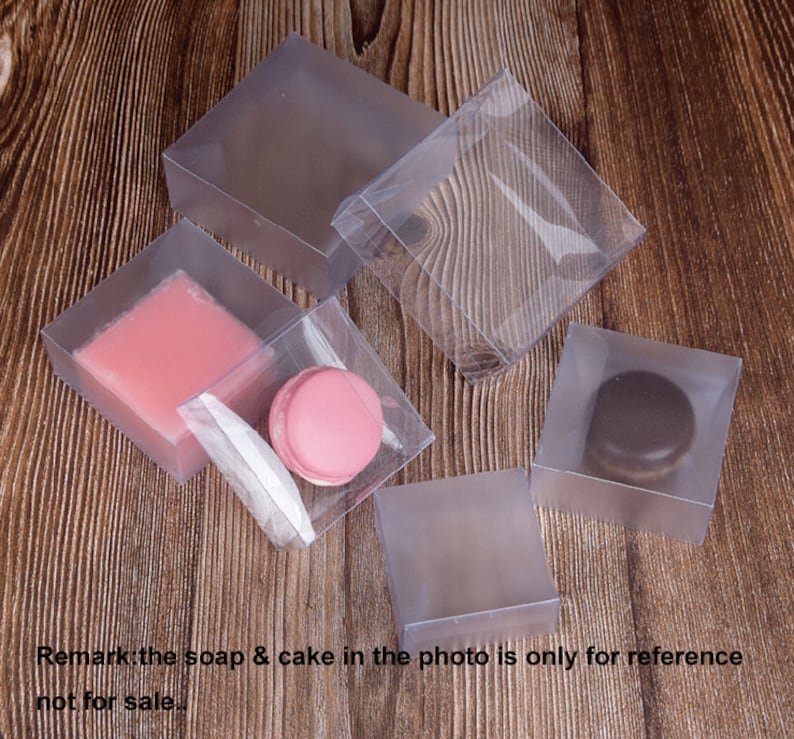
Find the location of a particular element. The height and width of the screenshot is (739, 794). box is located at coordinates pos(691,483).